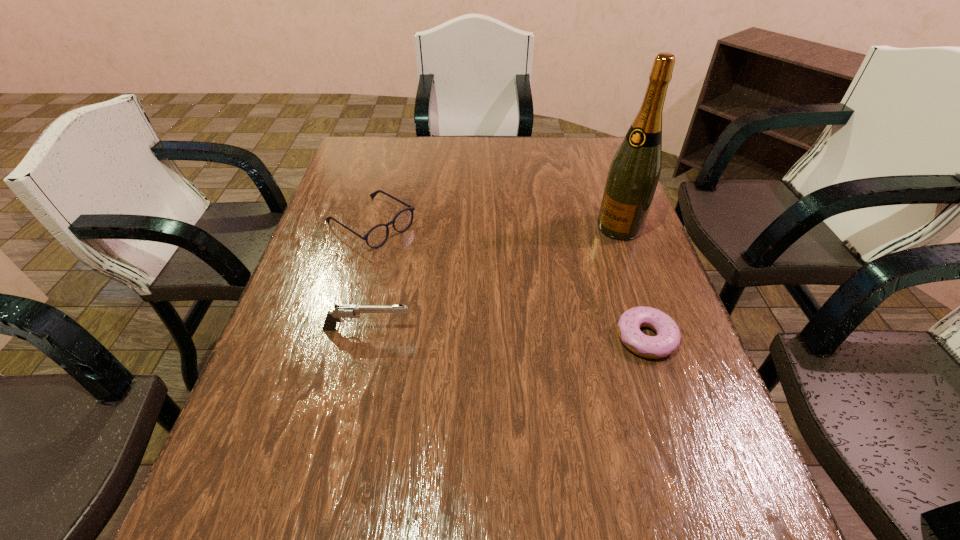
The image size is (960, 540). I want to click on empty space between the tallest object and the pistol, so click(493, 278).

Find the location of a particular element. Image resolution: width=960 pixels, height=540 pixels. empty space between the wine bottle and the third shortest object is located at coordinates (493, 278).

I want to click on vacant point located between the wine bottle and the shortest object, so click(633, 282).

At what (x,y) coordinates should I click in order to perform the action: click on vacant space in between the wine bottle and the pistol. Please return your answer as a coordinate pair (x, y). This screenshot has width=960, height=540. Looking at the image, I should click on (493, 278).

The height and width of the screenshot is (540, 960). What are the coordinates of `blank region between the spectacles and the wine bottle` in the screenshot? It's located at (495, 226).

Find the location of a particular element. The width and height of the screenshot is (960, 540). free space between the wine bottle and the third tallest object is located at coordinates (495, 226).

Where is `free space between the doughnut and the tallest object`? free space between the doughnut and the tallest object is located at coordinates (633, 282).

The image size is (960, 540). What are the coordinates of `vacant point located between the second shortest object and the shortest object` in the screenshot? It's located at (509, 281).

Where is `vacant area that lies between the second tallest object and the tallest object`? The height and width of the screenshot is (540, 960). vacant area that lies between the second tallest object and the tallest object is located at coordinates (493, 278).

Identify the location of free space between the spectacles and the wine bottle. (495, 226).